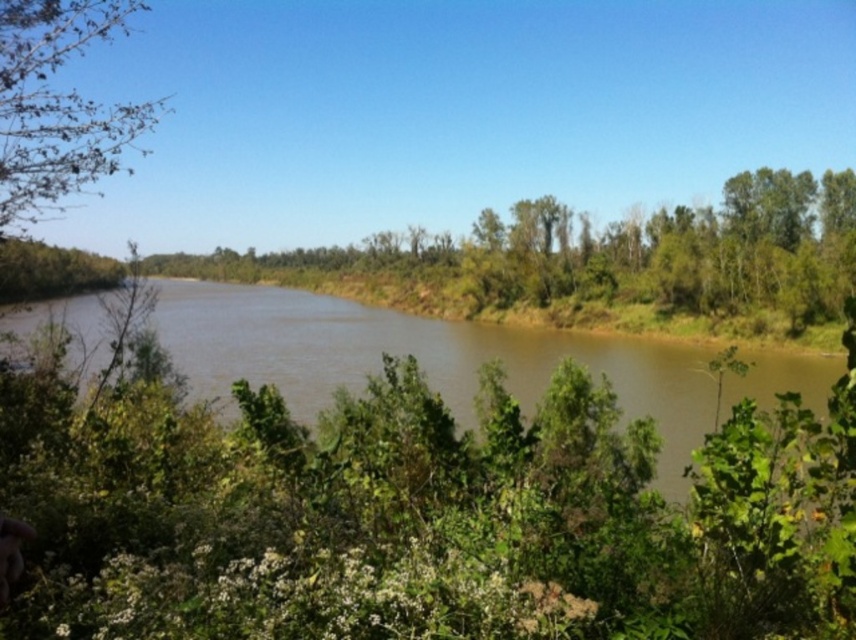
Question: Is brown muddy water at center positioned behind green leafy tree at upper left?

Choices:
 (A) no
 (B) yes

Answer: (A)

Question: Can you confirm if brown muddy water at center is thinner than green leafy tree at upper left?

Choices:
 (A) no
 (B) yes

Answer: (A)

Question: Does brown muddy water at center appear under green leafy tree at upper left?

Choices:
 (A) no
 (B) yes

Answer: (B)